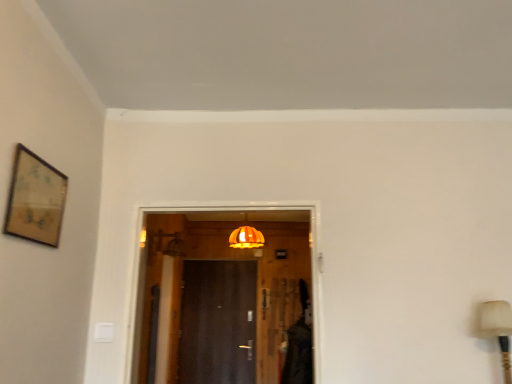
Describe the element at coordinates (246, 237) in the screenshot. The height and width of the screenshot is (384, 512). I see `orange fabric lampshade at center` at that location.

At what (x,y) coordinates should I click in order to perform the action: click on dark wood door at center. Please return your answer as a coordinate pair (x, y). The image size is (512, 384). Looking at the image, I should click on (218, 322).

Consider the image. Considering the sizes of dark wood door at center and wooden framed artwork at upper left in the image, is dark wood door at center wider or thinner than wooden framed artwork at upper left?

dark wood door at center is wider than wooden framed artwork at upper left.

Who is smaller, dark wood door at center or wooden framed artwork at upper left?

Smaller between the two is wooden framed artwork at upper left.

Which object is positioned more to the right, dark wood door at center or wooden framed artwork at upper left?

From the viewer's perspective, dark wood door at center appears more on the right side.

Is point (19, 207) farther from viewer compared to point (487, 327)?

No, it is in front of (487, 327).

Considering the relative positions of wooden framed artwork at upper left and matte beige table lamp at right in the image provided, is wooden framed artwork at upper left behind matte beige table lamp at right?

No, wooden framed artwork at upper left is closer to the camera.

Does wooden framed artwork at upper left have a lesser width compared to matte beige table lamp at right?

Correct, the width of wooden framed artwork at upper left is less than that of matte beige table lamp at right.

Can you see wooden framed artwork at upper left touching matte beige table lamp at right?

No, wooden framed artwork at upper left is not with matte beige table lamp at right.

Would you say wooden framed artwork at upper left is a long distance from orange fabric lampshade at center?

Absolutely, wooden framed artwork at upper left is distant from orange fabric lampshade at center.

Does wooden framed artwork at upper left have a smaller size compared to orange fabric lampshade at center?

Yes.

Considering the sizes of wooden framed artwork at upper left and orange fabric lampshade at center in the image, is wooden framed artwork at upper left taller or shorter than orange fabric lampshade at center?

wooden framed artwork at upper left is shorter than orange fabric lampshade at center.

Considering the positions of objects wooden framed artwork at upper left and orange fabric lampshade at center in the image provided, who is more to the left, wooden framed artwork at upper left or orange fabric lampshade at center?

Positioned to the left is wooden framed artwork at upper left.

In the scene shown: From the image's perspective, is dark wood door at center located above or below orange fabric lampshade at center?

Clearly, from the image's perspective, dark wood door at center is below orange fabric lampshade at center.

Which point is more distant from viewer, (252,339) or (249,244)?

The point (252,339) is farther from the camera.

From a real-world perspective, is dark wood door at center on top of orange fabric lampshade at center?

No, from a real-world perspective, dark wood door at center is not above orange fabric lampshade at center.

Is orange fabric lampshade at center in contact with matte beige table lamp at right?

orange fabric lampshade at center and matte beige table lamp at right are not in contact.

Where is `light fixture above the matte beige table lamp at right (from a real-world perspective)`? The image size is (512, 384). light fixture above the matte beige table lamp at right (from a real-world perspective) is located at coordinates (x=246, y=237).

How many degrees apart are the facing directions of orange fabric lampshade at center and matte beige table lamp at right?

There is a 2.42-degree angle between the facing directions of orange fabric lampshade at center and matte beige table lamp at right.

Is orange fabric lampshade at center taller than matte beige table lamp at right?

No.

Is dark wood door at center not close to matte beige table lamp at right?

dark wood door at center is far away from matte beige table lamp at right.

Looking at this image, is dark wood door at center positioned before matte beige table lamp at right?

No, it is not.

Is dark wood door at center positioned beyond the bounds of matte beige table lamp at right?

Yes.

Considering the relative positions of dark wood door at center and matte beige table lamp at right in the image provided, is dark wood door at center to the left or to the right of matte beige table lamp at right?

In the image, dark wood door at center appears on the left side of matte beige table lamp at right.

In the scene shown: Is orange fabric lampshade at center at the right side of wooden framed artwork at upper left?

Yes.

Who is shorter, orange fabric lampshade at center or wooden framed artwork at upper left?

Standing shorter between the two is wooden framed artwork at upper left.

Locate an element on the screen. picture frame in front of the orange fabric lampshade at center is located at coordinates (35, 199).

Locate an element on the screen. The width and height of the screenshot is (512, 384). picture frame in front of the dark wood door at center is located at coordinates (35, 199).

The height and width of the screenshot is (384, 512). Identify the location of table lamp to the right of wooden framed artwork at upper left. (498, 329).

From the image, which object appears to be farther from wooden framed artwork at upper left, orange fabric lampshade at center or matte beige table lamp at right?

orange fabric lampshade at center.

When comparing their distances from wooden framed artwork at upper left, does dark wood door at center or matte beige table lamp at right seem closer?

matte beige table lamp at right is closer to wooden framed artwork at upper left.

Looking at the image, which one is located closer to matte beige table lamp at right, wooden framed artwork at upper left or orange fabric lampshade at center?

Based on the image, wooden framed artwork at upper left appears to be nearer to matte beige table lamp at right.

In the scene shown: Which object lies nearer to the anchor point orange fabric lampshade at center, matte beige table lamp at right or wooden framed artwork at upper left?

matte beige table lamp at right is positioned closer to the anchor orange fabric lampshade at center.

When comparing their distances from orange fabric lampshade at center, does matte beige table lamp at right or dark wood door at center seem closer?

Among the two, dark wood door at center is located nearer to orange fabric lampshade at center.

When comparing their distances from dark wood door at center, does orange fabric lampshade at center or matte beige table lamp at right seem further?

matte beige table lamp at right is positioned further to the anchor dark wood door at center.

Based on their spatial positions, is orange fabric lampshade at center or wooden framed artwork at upper left closer to dark wood door at center?

orange fabric lampshade at center is closer to dark wood door at center.

Looking at the image, which one is located further to dark wood door at center, wooden framed artwork at upper left or matte beige table lamp at right?

The object further to dark wood door at center is wooden framed artwork at upper left.

Where is `table lamp between wooden framed artwork at upper left and dark wood door at center along the z-axis`? The height and width of the screenshot is (384, 512). table lamp between wooden framed artwork at upper left and dark wood door at center along the z-axis is located at coordinates (498, 329).

Locate an element on the screen. The height and width of the screenshot is (384, 512). table lamp located between wooden framed artwork at upper left and orange fabric lampshade at center in the depth direction is located at coordinates (498, 329).

What are the coordinates of `light fixture positioned between matte beige table lamp at right and dark wood door at center from near to far` in the screenshot? It's located at (246, 237).

The image size is (512, 384). Identify the location of light fixture located between wooden framed artwork at upper left and dark wood door at center in the depth direction. (246, 237).